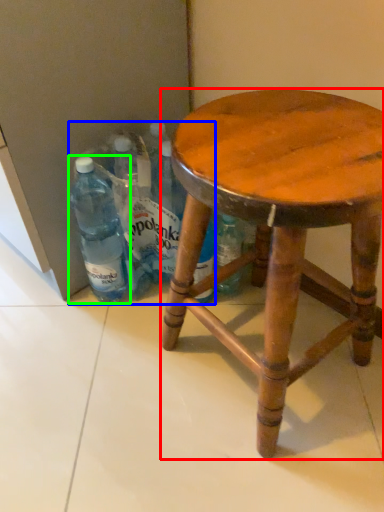
Question: Estimate the real-world distances between objects in this image. Which object is farther from stool (highlighted by a red box), beverage (highlighted by a blue box) or bottle (highlighted by a green box)?

Choices:
 (A) beverage
 (B) bottle

Answer: (B)